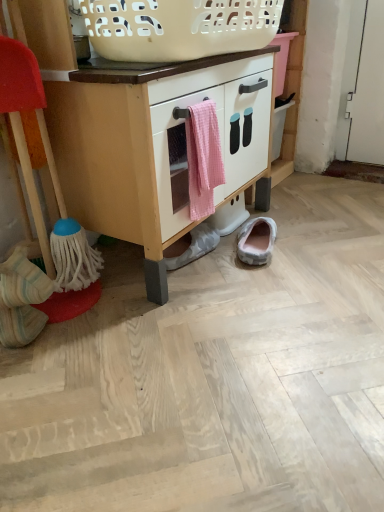
Question: Does white matte cabinet at center have a smaller size compared to white striped socks at lower left, the 3th footwear when ordered from right to left?

Choices:
 (A) no
 (B) yes

Answer: (A)

Question: Considering the relative sizes of white matte cabinet at center and white striped socks at lower left, acting as the 1th footwear starting from the front, in the image provided, is white matte cabinet at center taller than white striped socks at lower left, acting as the 1th footwear starting from the front,?

Choices:
 (A) no
 (B) yes

Answer: (B)

Question: Does white matte cabinet at center have a larger size compared to white striped socks at lower left, which ranks as the third footwear in back-to-front order?

Choices:
 (A) yes
 (B) no

Answer: (A)

Question: Does white matte cabinet at center have a lesser width compared to white striped socks at lower left, which is the 1th footwear in left-to-right order?

Choices:
 (A) yes
 (B) no

Answer: (B)

Question: Can you confirm if white matte cabinet at center is positioned to the right of white striped socks at lower left, acting as the 1th footwear starting from the front?

Choices:
 (A) no
 (B) yes

Answer: (B)

Question: Considering the positions of point (256, 148) and point (158, 170), is point (256, 148) closer or farther from the camera than point (158, 170)?

Choices:
 (A) farther
 (B) closer

Answer: (A)

Question: Looking at the image, does white matte cabinet at center seem bigger or smaller compared to pink gingham towel at center?

Choices:
 (A) small
 (B) big

Answer: (B)

Question: Is white matte cabinet at center spatially inside pink gingham towel at center, or outside of it?

Choices:
 (A) inside
 (B) outside

Answer: (B)

Question: Considering the positions of white matte cabinet at center and pink gingham towel at center in the image, is white matte cabinet at center wider or thinner than pink gingham towel at center?

Choices:
 (A) wide
 (B) thin

Answer: (A)

Question: Considering the positions of white plastic basket at upper center and gray suede slipper at lower center, which is the third footwear from front to back, in the image, is white plastic basket at upper center wider or thinner than gray suede slipper at lower center, which is the third footwear from front to back,?

Choices:
 (A) thin
 (B) wide

Answer: (B)

Question: From a real-world perspective, is white plastic basket at upper center above or below gray suede slipper at lower center, arranged as the first footwear when viewed from the right?

Choices:
 (A) above
 (B) below

Answer: (A)

Question: Considering their positions, is white plastic basket at upper center located in front of or behind gray suede slipper at lower center, arranged as the first footwear when viewed from the right?

Choices:
 (A) front
 (B) behind

Answer: (A)

Question: Considering the positions of white plastic basket at upper center and gray suede slipper at lower center, arranged as the first footwear when viewed from the right, in the image, is white plastic basket at upper center taller or shorter than gray suede slipper at lower center, arranged as the first footwear when viewed from the right,?

Choices:
 (A) short
 (B) tall

Answer: (B)

Question: Is white matte cabinet at center bigger or smaller than white plastic basket at upper center?

Choices:
 (A) big
 (B) small

Answer: (A)

Question: Considering the relative positions of white matte cabinet at center and white plastic basket at upper center in the image provided, is white matte cabinet at center to the left or to the right of white plastic basket at upper center?

Choices:
 (A) left
 (B) right

Answer: (A)